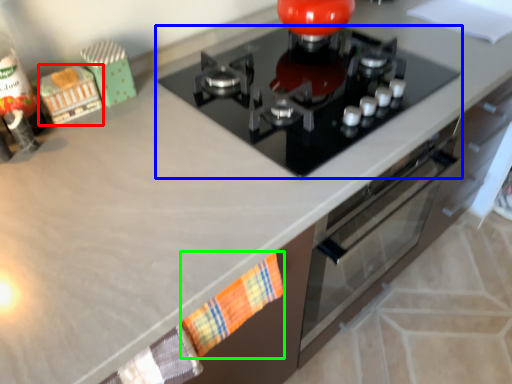
Question: Which object is the closest to the toy (highlighted by a red box)? Choose among these: gas stove (highlighted by a blue box) or hand towel (highlighted by a green box).

Choices:
 (A) gas stove
 (B) hand towel

Answer: (A)